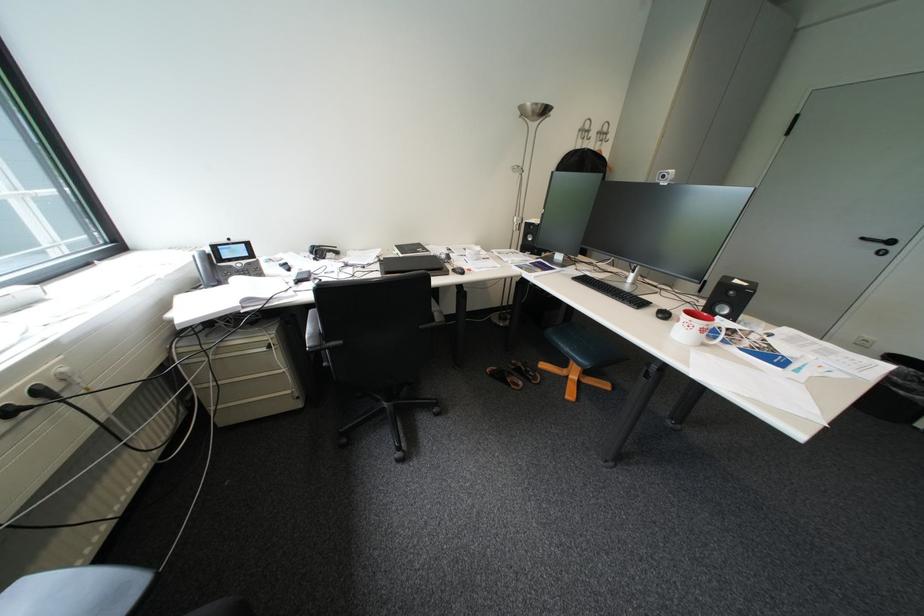
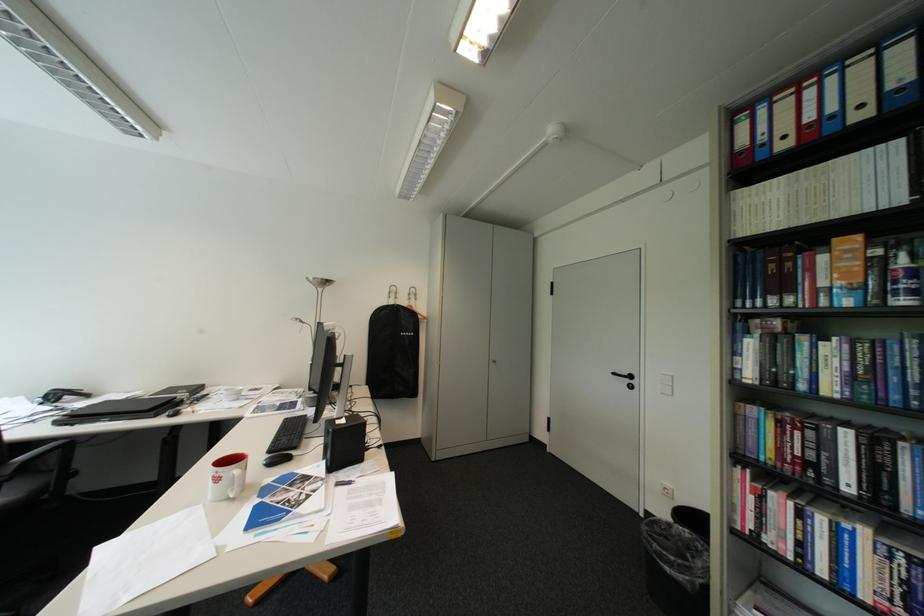
Find the pixel in the second image that matches [331,253] in the first image.

(67, 397)